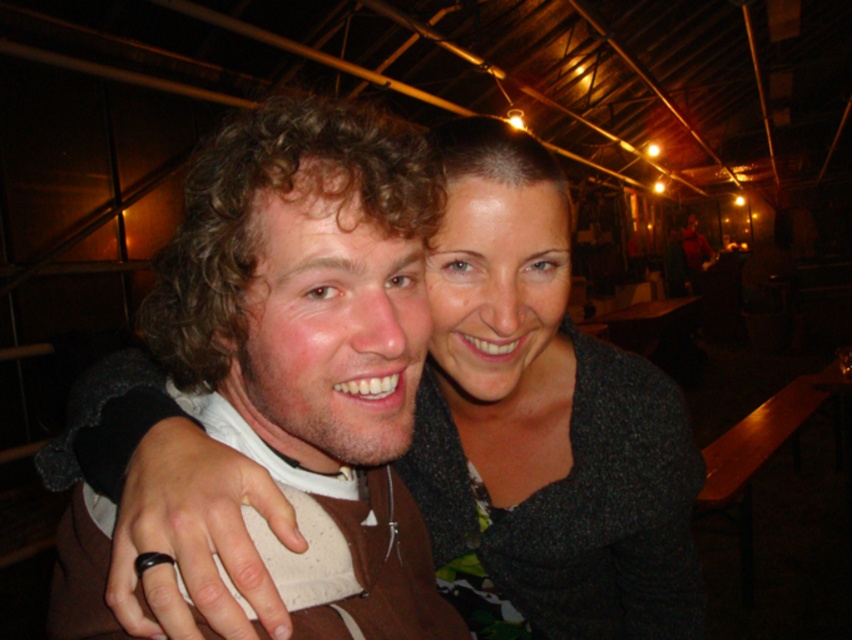
Question: Can you confirm if brown fuzzy jacket at center is wider than matte gray sweater at center?

Choices:
 (A) yes
 (B) no

Answer: (B)

Question: Can you confirm if brown fuzzy jacket at center is bigger than matte gray sweater at center?

Choices:
 (A) yes
 (B) no

Answer: (B)

Question: From the image, what is the correct spatial relationship of brown fuzzy jacket at center in relation to matte gray sweater at center?

Choices:
 (A) left
 (B) right

Answer: (A)

Question: Which of the following is the farthest from the observer?

Choices:
 (A) (432, 257)
 (B) (384, 243)

Answer: (A)

Question: Which of the following is the closest to the observer?

Choices:
 (A) brown fuzzy jacket at center
 (B) matte gray sweater at center

Answer: (A)

Question: Which of the following is the farthest from the observer?

Choices:
 (A) matte gray sweater at center
 (B) brown fuzzy jacket at center

Answer: (A)